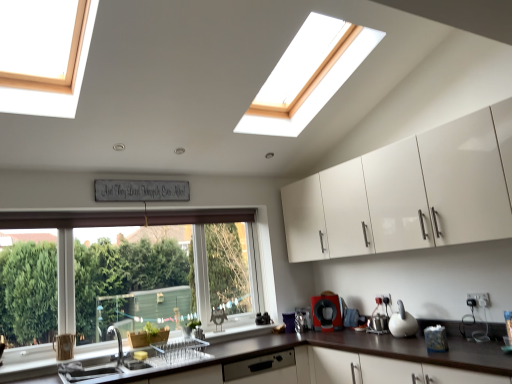
Question: From their relative heights in the image, would you say satin silver dishwasher at lower center is taller or shorter than matte stainless steel sink at lower left?

Choices:
 (A) short
 (B) tall

Answer: (B)

Question: Visually, is satin silver dishwasher at lower center positioned to the left or to the right of matte stainless steel sink at lower left?

Choices:
 (A) right
 (B) left

Answer: (A)

Question: Which is farther from the metallic silver kettle at center right, the first appliance from the left?

Choices:
 (A) white glossy cabinet at upper right
 (B) brown matte countertop at lower left
 (C) black matte coffee maker at lower center, placed as the second appliance when sorted from front to back
 (D) matte stainless steel sink at lower left
 (E) white glossy kettle at right, the third appliance viewed from the back

Answer: (D)

Question: Estimate the real-world distances between objects in this image. Which object is closer to the white glossy cabinet at upper right?

Choices:
 (A) metallic silver kettle at center right, acting as the third appliance starting from the right
 (B) clear glass window at lower left
 (C) silver metallic tap at lower left
 (D) brown matte countertop at lower left
 (E) white glossy kettle at right, which is the first appliance from right to left

Answer: (D)